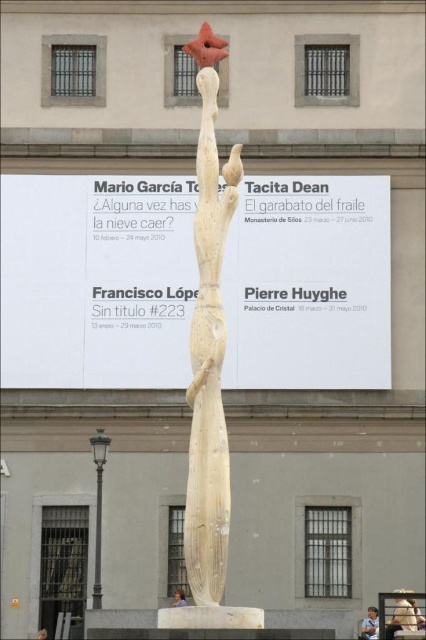
Based on the photo, does light brown hair at center appear over blonde hair at center?

Actually, light brown hair at center is below blonde hair at center.

Who is more forward, (377, 628) or (175, 589)?

Point (377, 628) is more forward.

This screenshot has width=426, height=640. What are the coordinates of `light brown hair at center` in the screenshot? It's located at (370, 625).

Where is `light brown hair at center`? light brown hair at center is located at coordinates (370, 625).

Which of these two, wooden statue at center or light brown hair at center, stands taller?

wooden statue at center is taller.

Does point (201, 582) come behind point (371, 609)?

No, (201, 582) is in front of (371, 609).

Locate an element on the screen. This screenshot has height=640, width=426. wooden statue at center is located at coordinates (209, 372).

Does wooden statue at center have a greater width compared to blonde hair at center?

Yes.

Describe the element at coordinates (209, 372) in the screenshot. The height and width of the screenshot is (640, 426). I see `wooden statue at center` at that location.

Identify the location of wooden statue at center. This screenshot has height=640, width=426. (209, 372).